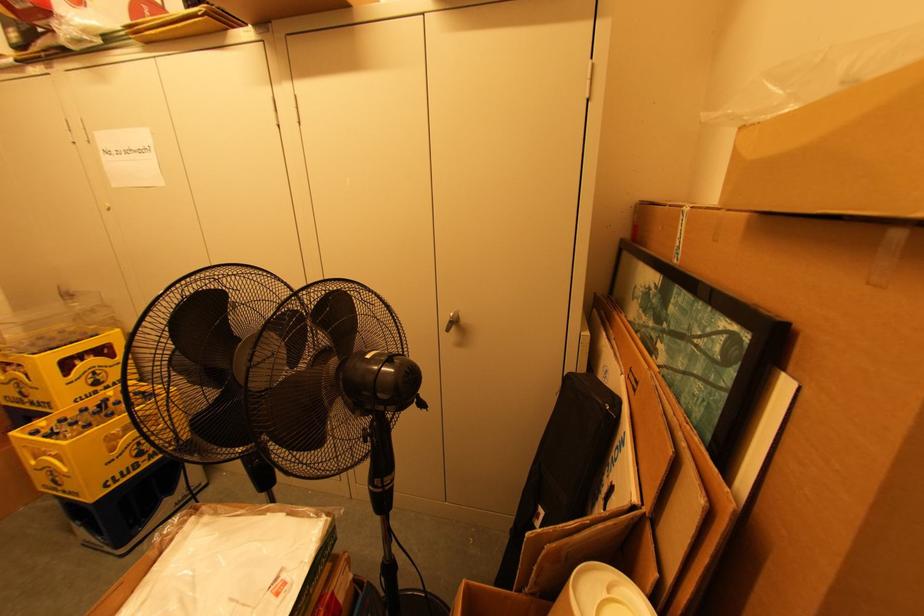
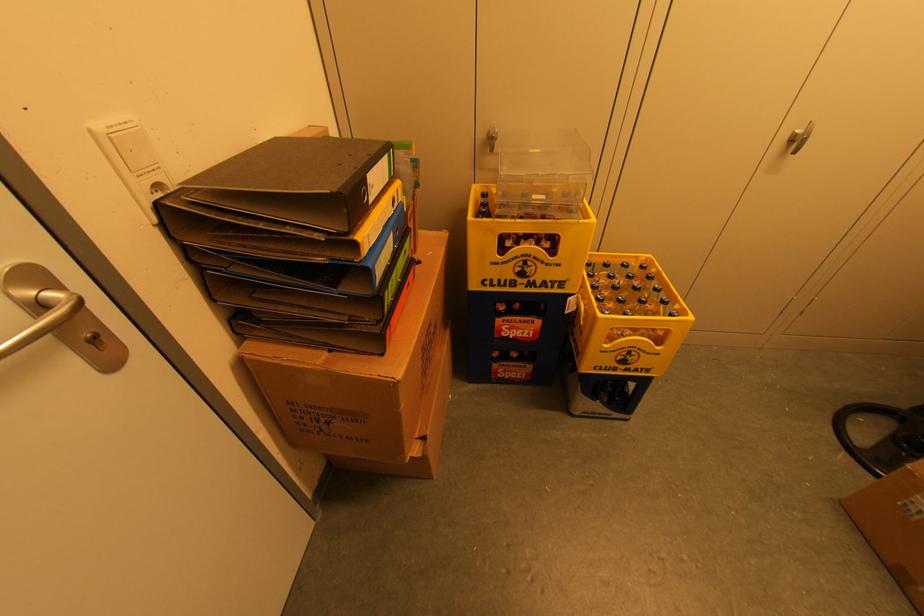
Where in the second image is the point corresponding to pixel 27 391 from the first image?

(530, 270)